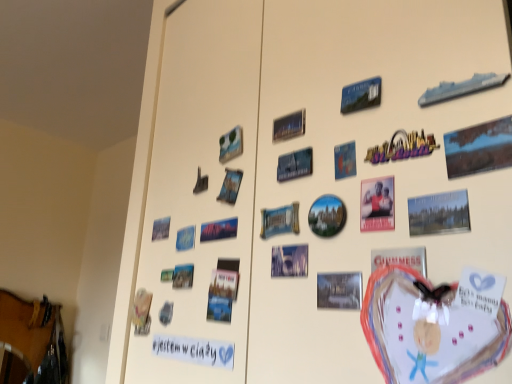
Question: Can you confirm if blue glossy postcard at upper center, the eighth postcard in the left-to-right sequence, is smaller than blue paper at upper left, the twelfth postcard positioned from the right?

Choices:
 (A) no
 (B) yes

Answer: (B)

Question: Does blue glossy postcard at upper center, the eighth postcard in the left-to-right sequence, have a greater width compared to blue paper at upper left, the twelfth postcard positioned from the right?

Choices:
 (A) no
 (B) yes

Answer: (B)

Question: Is blue glossy postcard at upper center, the eighth postcard in the left-to-right sequence, positioned behind blue paper at upper left, the twelfth postcard positioned from the right?

Choices:
 (A) no
 (B) yes

Answer: (A)

Question: Considering the relative positions of blue glossy postcard at upper center, the eighth postcard in the left-to-right sequence, and blue paper at upper left, positioned as the second postcard in left-to-right order, in the image provided, is blue glossy postcard at upper center, the eighth postcard in the left-to-right sequence, to the right of blue paper at upper left, positioned as the second postcard in left-to-right order, from the viewer's perspective?

Choices:
 (A) yes
 (B) no

Answer: (A)

Question: Does blue glossy postcard at upper center, the 6th postcard viewed from the right, have a lesser width compared to blue paper at upper left, the twelfth postcard positioned from the right?

Choices:
 (A) yes
 (B) no

Answer: (B)

Question: From the image's perspective, is matte plastic poster at center right, placed as the 10th postcard when sorted from left to right, located above or below blue paper at upper left, positioned as the second postcard in left-to-right order?

Choices:
 (A) below
 (B) above

Answer: (B)

Question: Based on their positions, is matte plastic poster at center right, which ranks as the 4th postcard in right-to-left order, located to the left or right of blue paper at upper left, positioned as the second postcard in left-to-right order?

Choices:
 (A) right
 (B) left

Answer: (A)

Question: From a real-world perspective, is matte plastic poster at center right, which ranks as the 4th postcard in right-to-left order, positioned above or below blue paper at upper left, the twelfth postcard positioned from the right?

Choices:
 (A) above
 (B) below

Answer: (A)

Question: Is matte plastic poster at center right, which ranks as the 4th postcard in right-to-left order, inside the boundaries of blue paper at upper left, the twelfth postcard positioned from the right, or outside?

Choices:
 (A) outside
 (B) inside

Answer: (A)

Question: Relative to metallic silver postcard at center, which is the 7th postcard in left-to-right order, is matte paper postcard at upper right, arranged as the 12th postcard when viewed from the left, in front or behind?

Choices:
 (A) front
 (B) behind

Answer: (A)

Question: Does point (436, 226) appear closer or farther from the camera than point (320, 307)?

Choices:
 (A) closer
 (B) farther

Answer: (A)

Question: Considering the positions of matte paper postcard at upper right, which is the second postcard from right to left, and metallic silver postcard at center, which is the 7th postcard in left-to-right order, in the image, is matte paper postcard at upper right, which is the second postcard from right to left, wider or thinner than metallic silver postcard at center, which is the 7th postcard in left-to-right order,?

Choices:
 (A) wide
 (B) thin

Answer: (B)

Question: Is matte paper postcard at upper right, which is the second postcard from right to left, taller or shorter than metallic silver postcard at center, the 7th postcard in the right-to-left sequence?

Choices:
 (A) tall
 (B) short

Answer: (A)

Question: From a real-world perspective, is blue plastic postcard at upper right, which is the fifth postcard from right to left, physically located above or below matte paper postcard at upper right, which is the second postcard from right to left?

Choices:
 (A) below
 (B) above

Answer: (B)

Question: Looking at their shapes, would you say blue plastic postcard at upper right, which is the fifth postcard from right to left, is wider or thinner than matte paper postcard at upper right, arranged as the 12th postcard when viewed from the left?

Choices:
 (A) thin
 (B) wide

Answer: (A)